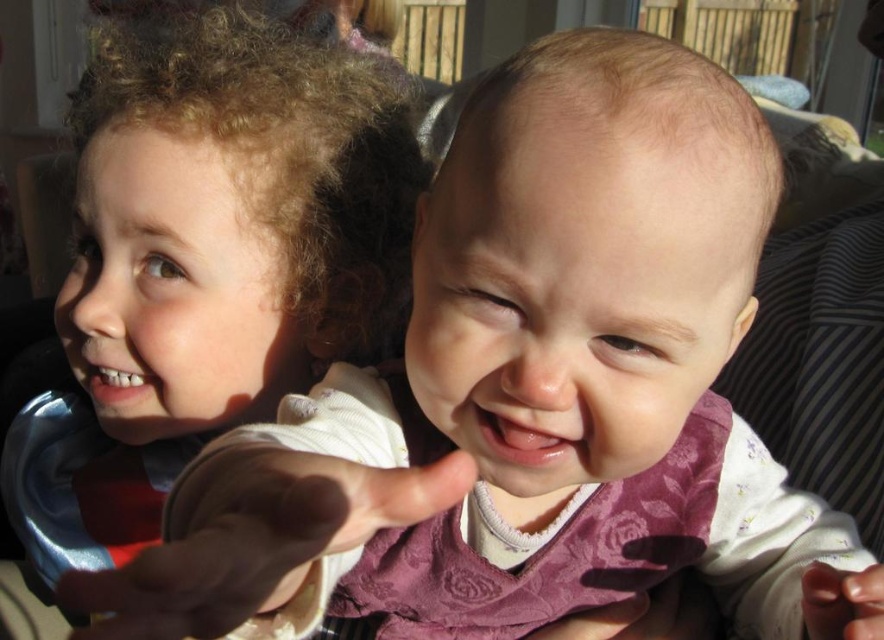
Looking at this image, you are a photographer trying to capture a close shot of the curly hair at upper left and the smooth skin hand at center. Which object would you need to frame more carefully due to its larger size?

The curly hair at upper left has a greater width than the smooth skin hand at center, so it requires more careful framing due to its larger size.

You are a photographer adjusting the focus on your camera. You notice two points in the image at coordinates point (113, 506) and point (193, 552). Which point is closer to the camera lens?

Point (113, 506) is closer to the camera lens than point (193, 552) because it is further to the camera according to the description.

You are a photographer adjusting the focus of your camera. The camera has a focus point at coordinates 0.402, 0.240. Which object from the scene should you focus on to capture the curly hair at upper left clearly?

The curly hair at upper left is located at point (x=211, y=257), so you should focus on the curly hair at upper left to capture it clearly.